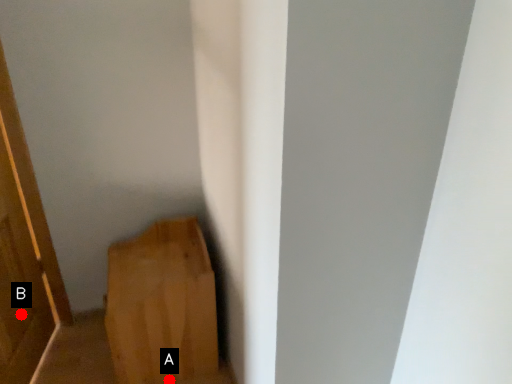
Question: Two points are circled on the image, labeled by A and B beside each circle. Which point is closer to the camera?

Choices:
 (A) A is closer
 (B) B is closer

Answer: (B)